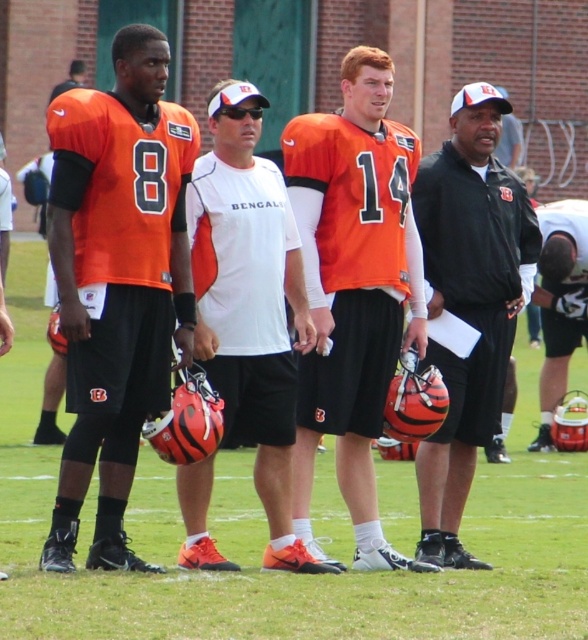
Question: Which is farther from the white matte shirt at center?

Choices:
 (A) black matte helmet at center
 (B) white matte helmet at center

Answer: (B)

Question: Which object is positioned closest to the white matte helmet at center?

Choices:
 (A) matte orange jersey at left
 (B) orange matte jersey at center

Answer: (B)

Question: Can you confirm if white matte shirt at center is smaller than black matte helmet at center?

Choices:
 (A) yes
 (B) no

Answer: (B)

Question: Does orange matte jersey at center appear on the right side of white matte helmet at center?

Choices:
 (A) yes
 (B) no

Answer: (B)

Question: Which object appears closest to the camera in this image?

Choices:
 (A) matte orange jersey at left
 (B) black matte helmet at center
 (C) white matte shirt at center

Answer: (A)

Question: Is matte orange jersey at left bigger than white matte shirt at center?

Choices:
 (A) no
 (B) yes

Answer: (B)